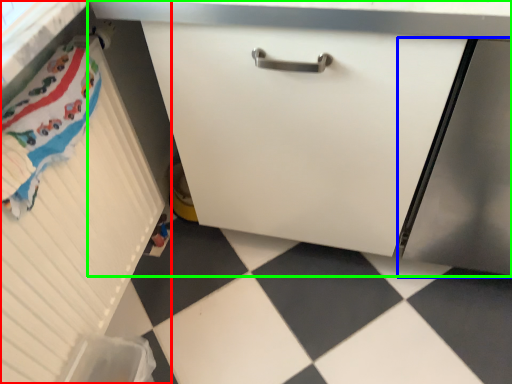
Question: Based on their relative distances, which object is nearer to cabinetry (highlighted by a red box)? Choose from screen door (highlighted by a blue box) and cabinetry (highlighted by a green box).

Choices:
 (A) screen door
 (B) cabinetry

Answer: (B)